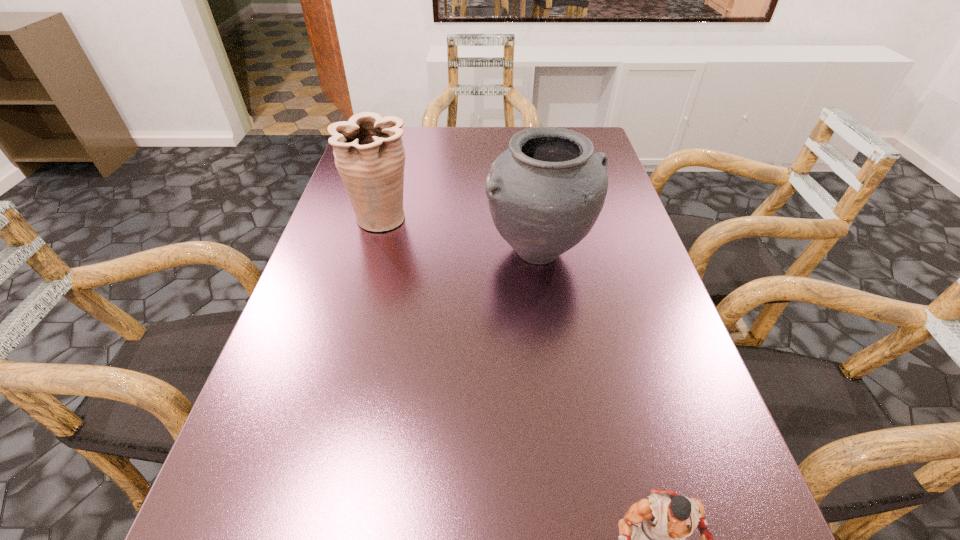
Find the location of a particular element. The width and height of the screenshot is (960, 540). vacant area that lies between the right urn and the leftmost object is located at coordinates (461, 234).

At what (x,y) coordinates should I click in order to perform the action: click on vacant point located between the left urn and the right urn. Please return your answer as a coordinate pair (x, y). The height and width of the screenshot is (540, 960). Looking at the image, I should click on (461, 234).

At what (x,y) coordinates should I click in order to perform the action: click on blank region between the right urn and the leftmost object. Please return your answer as a coordinate pair (x, y). The width and height of the screenshot is (960, 540). Looking at the image, I should click on (461, 234).

Where is `free space between the left urn and the right urn`? The height and width of the screenshot is (540, 960). free space between the left urn and the right urn is located at coordinates (461, 234).

Identify the location of object that is the nearest to the leftmost object. The width and height of the screenshot is (960, 540). (545, 192).

Identify which object is located as the second nearest to the puncher. Please provide its 2D coordinates. Your answer should be formatted as a tuple, i.e. [(x, y)], where the tuple contains the x and y coordinates of a point satisfying the conditions above.

[(369, 155)]